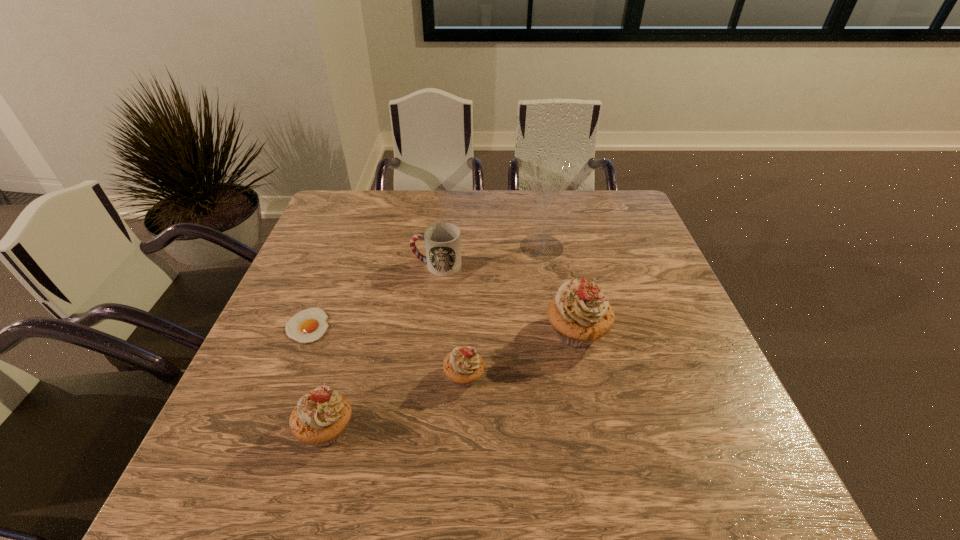
At what (x,y) coordinates should I click in order to perform the action: click on the nearest object. Please return your answer as a coordinate pair (x, y). Image resolution: width=960 pixels, height=540 pixels. Looking at the image, I should click on (320, 417).

Locate an element on the screen. The width and height of the screenshot is (960, 540). the leftmost cupcake is located at coordinates (320, 417).

Image resolution: width=960 pixels, height=540 pixels. Identify the location of the shortest cupcake. (463, 366).

Locate an element on the screen. The image size is (960, 540). the fifth farthest object is located at coordinates pyautogui.click(x=463, y=366).

I want to click on the rightmost cupcake, so click(x=580, y=314).

Locate an element on the screen. The height and width of the screenshot is (540, 960). the farthest cupcake is located at coordinates (580, 314).

Identify the location of cup. The height and width of the screenshot is (540, 960). (442, 240).

Where is `the leftmost object`? The image size is (960, 540). the leftmost object is located at coordinates coord(309,325).

Identify the location of the shortest object. (309, 325).

Locate an element on the screen. The height and width of the screenshot is (540, 960). flute glass is located at coordinates (549, 177).